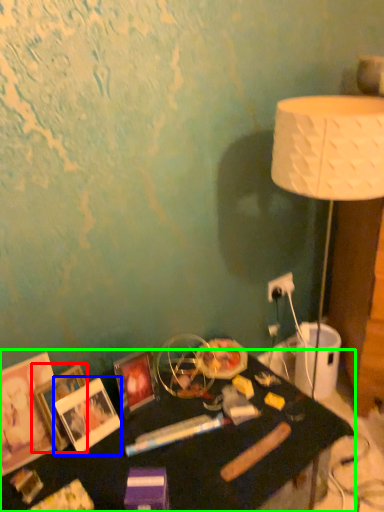
Question: Which object is positioned closest to picture frame (highlighted by a red box)? Select from picture frame (highlighted by a blue box) and table (highlighted by a green box).

Choices:
 (A) picture frame
 (B) table

Answer: (A)